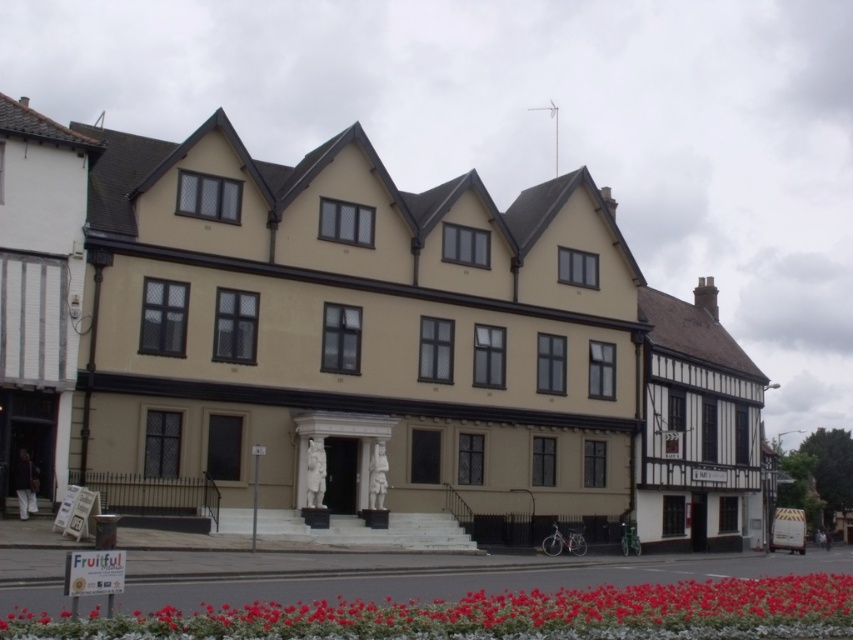
Question: Among these points, which one is nearest to the camera?

Choices:
 (A) (697, 387)
 (B) (80, 627)

Answer: (B)

Question: Is beige stone building at center below wooden half-timbered house at right?

Choices:
 (A) yes
 (B) no

Answer: (B)

Question: Which point is farther from the camera taking this photo?

Choices:
 (A) (708, 310)
 (B) (74, 218)

Answer: (A)

Question: Which point is farther to the camera?

Choices:
 (A) white timber-framed building at left
 (B) beige stone building at center
 (C) vivid red petals at lower center

Answer: (B)

Question: From the image, what is the correct spatial relationship of beige stone building at center in relation to vivid red petals at lower center?

Choices:
 (A) below
 (B) above

Answer: (B)

Question: Does white timber-framed building at left appear under wooden half-timbered house at right?

Choices:
 (A) no
 (B) yes

Answer: (A)